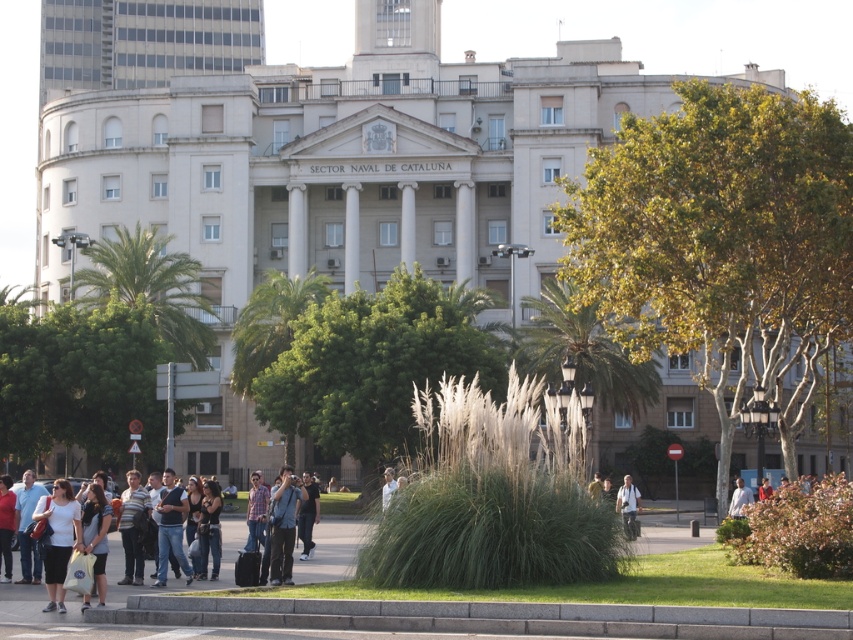
Question: Can you confirm if matte black camera at center is positioned above light brown leather jacket at center?

Choices:
 (A) no
 (B) yes

Answer: (B)

Question: Which is nearer to the white cotton shirt at lower right?

Choices:
 (A) matte black camera at center
 (B) light brown leather jacket at center

Answer: (B)

Question: Does matte black camera at center have a smaller size compared to white cotton shirt at lower right?

Choices:
 (A) no
 (B) yes

Answer: (B)

Question: Which of these objects is positioned closest to the matte black camera at center?

Choices:
 (A) white cotton shirt at lower right
 (B) light brown leather jacket at center

Answer: (B)

Question: Which point is farther to the camera?

Choices:
 (A) white cotton shirt at lower right
 (B) yellow fabric shirt at center
 (C) light brown backpack at lower right
 (D) light brown leather jacket at center

Answer: (A)

Question: Can you confirm if light brown leather jacket at center is thinner than yellow fabric shirt at center?

Choices:
 (A) yes
 (B) no

Answer: (A)